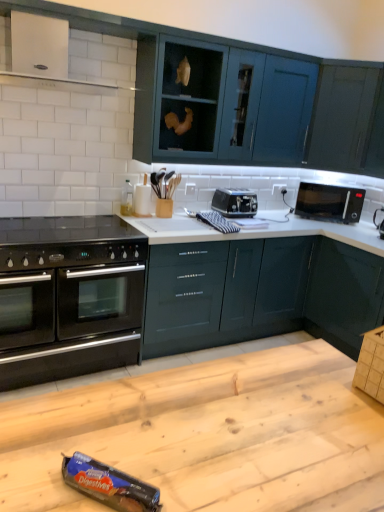
The width and height of the screenshot is (384, 512). Find the location of `vacant space to the left of blue cardboard digestives at lower center, marked as the 1th appliance in a front-to-back arrangement`. vacant space to the left of blue cardboard digestives at lower center, marked as the 1th appliance in a front-to-back arrangement is located at coordinates (47, 473).